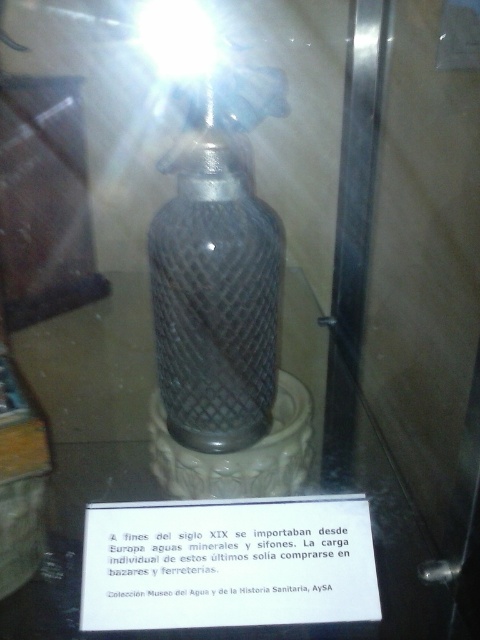
Who is positioned more to the left, metallic mesh bottle at center or white paper at center?

Positioned to the left is metallic mesh bottle at center.

Is metallic mesh bottle at center wider than white paper at center?

No, metallic mesh bottle at center is not wider than white paper at center.

What do you see at coordinates (216, 280) in the screenshot? I see `metallic mesh bottle at center` at bounding box center [216, 280].

Locate an element on the screen. The image size is (480, 640). metallic mesh bottle at center is located at coordinates (216, 280).